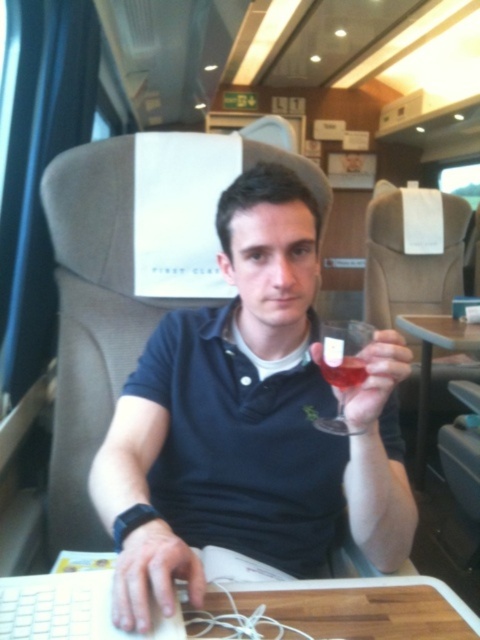
Question: Does matte black polo shirt at center appear under wooden table at lower center?

Choices:
 (A) no
 (B) yes

Answer: (A)

Question: In this image, where is matte black polo shirt at center located relative to translucent glass at center?

Choices:
 (A) left
 (B) right

Answer: (A)

Question: Which point is closer to the camera?

Choices:
 (A) translucent glass at center
 (B) wooden table at lower center
 (C) transparent glass at center
 (D) wooden table at center

Answer: (B)

Question: Which is nearer to the wooden table at lower center?

Choices:
 (A) wooden table at center
 (B) matte black polo shirt at center

Answer: (B)

Question: Estimate the real-world distances between objects in this image. Which object is closer to the wooden table at lower center?

Choices:
 (A) transparent glass at center
 (B) translucent glass at center
 (C) matte black polo shirt at center

Answer: (C)

Question: Does matte black polo shirt at center lie in front of wooden table at center?

Choices:
 (A) no
 (B) yes

Answer: (B)